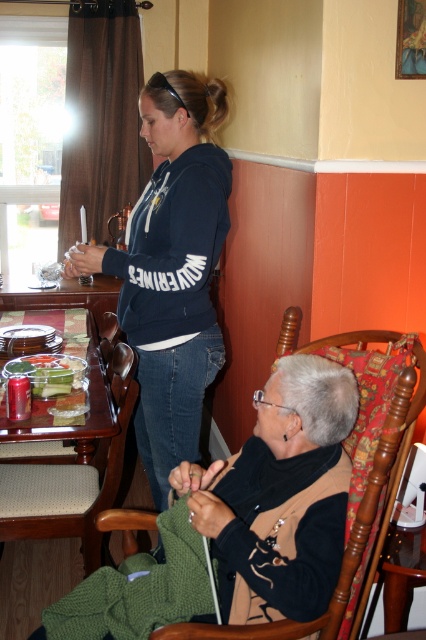
Based on the photo, you are a guest at a dinner party and need to place your coat on the brown wood chair at lower left without it falling off. Considering the clear glass tray at lower left is also present, which object has a smaller surface area to support the coat?

The brown wood chair at lower left has a lesser width compared to the clear glass tray at lower left, so the brown wood chair at lower left has a smaller surface area and might not support the coat as securely.